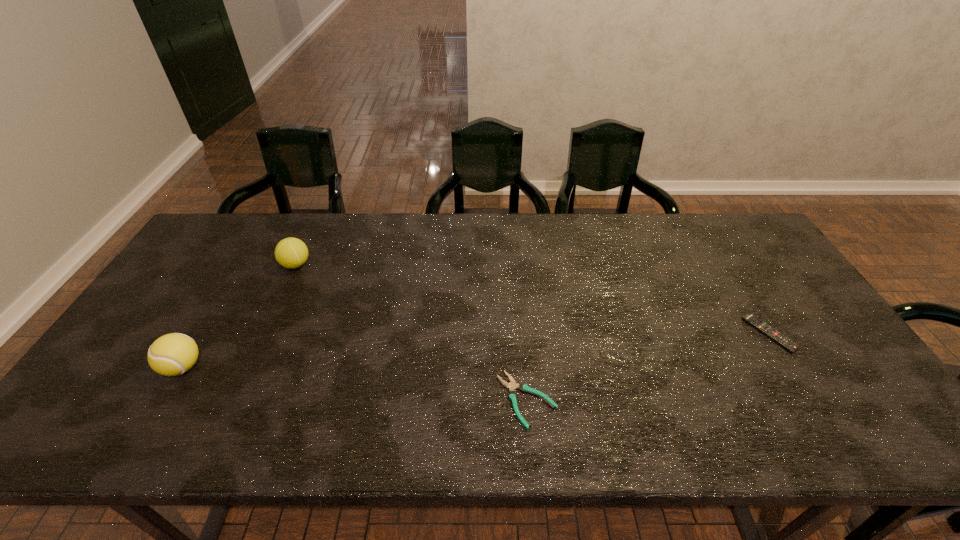
Where is `the second closest object to the remote control`? This screenshot has height=540, width=960. the second closest object to the remote control is located at coordinates (291, 253).

You are a GUI agent. You are given a task and a screenshot of the screen. Output one action in this format:
    pyautogui.click(x=<x>, y=<y>)
    Task: Click on the free location that satisfies the following two spatial constraints: 1. on the back side of the leftmost object; 2. on the right side of the remote control
    
    Given the screenshot: What is the action you would take?
    pyautogui.click(x=204, y=333)

The height and width of the screenshot is (540, 960). Identify the location of free space in the image that satisfies the following two spatial constraints: 1. on the front side of the remote control; 2. on the right side of the second object from left to right. (265, 333).

Where is `blank area in the image that satisfies the following two spatial constraints: 1. on the front side of the rightmost object; 2. on the left side of the farthest object`? blank area in the image that satisfies the following two spatial constraints: 1. on the front side of the rightmost object; 2. on the left side of the farthest object is located at coordinates (265, 333).

Where is `vacant area in the image that satisfies the following two spatial constraints: 1. on the back side of the right tennis ball; 2. on the left side of the left tennis ball`? This screenshot has height=540, width=960. vacant area in the image that satisfies the following two spatial constraints: 1. on the back side of the right tennis ball; 2. on the left side of the left tennis ball is located at coordinates (244, 265).